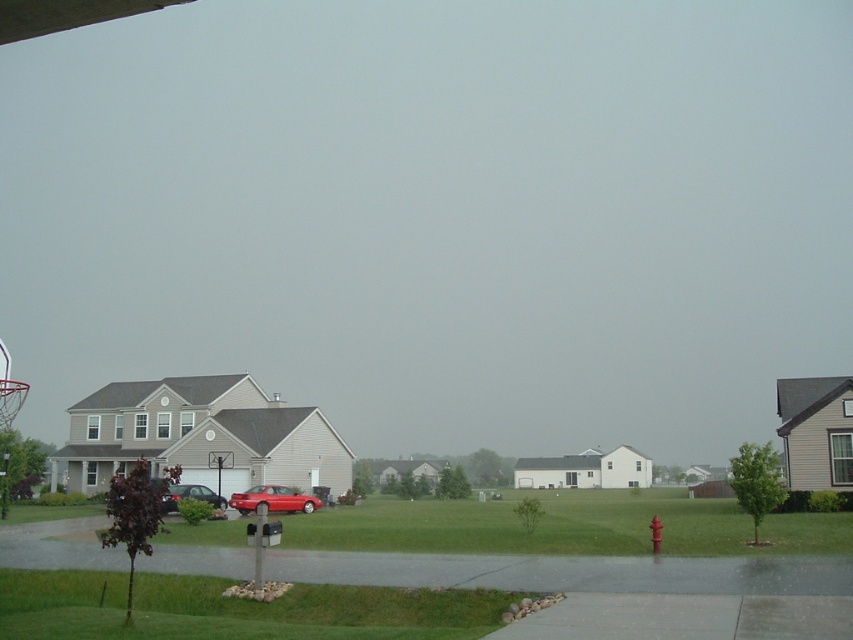
Question: Is metallic red sedan at center-left below red plastic fire hydrant at center?

Choices:
 (A) yes
 (B) no

Answer: (A)

Question: Does metallic red sedan at center-left appear under red plastic fire hydrant at center?

Choices:
 (A) yes
 (B) no

Answer: (A)

Question: Which object appears farthest from the camera in this image?

Choices:
 (A) red plastic fire hydrant at center
 (B) metallic silver basketball hoop at center
 (C) metallic red sedan at center-left

Answer: (B)

Question: Is glossy red car at center closer to camera compared to red plastic fire hydrant at center?

Choices:
 (A) no
 (B) yes

Answer: (A)

Question: Which point appears closest to the camera in this image?

Choices:
 (A) (660, 529)
 (B) (178, 496)
 (C) (289, 488)
 (D) (233, 461)

Answer: (A)

Question: Considering the real-world distances, which object is closest to the metallic silver basketball hoop at center?

Choices:
 (A) glossy red car at center
 (B) metallic red sedan at center-left

Answer: (B)